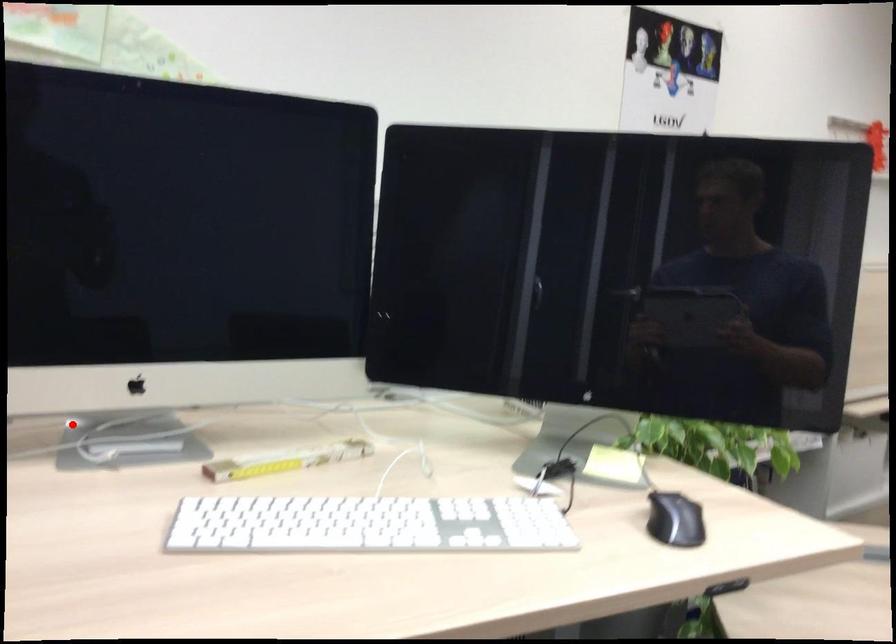
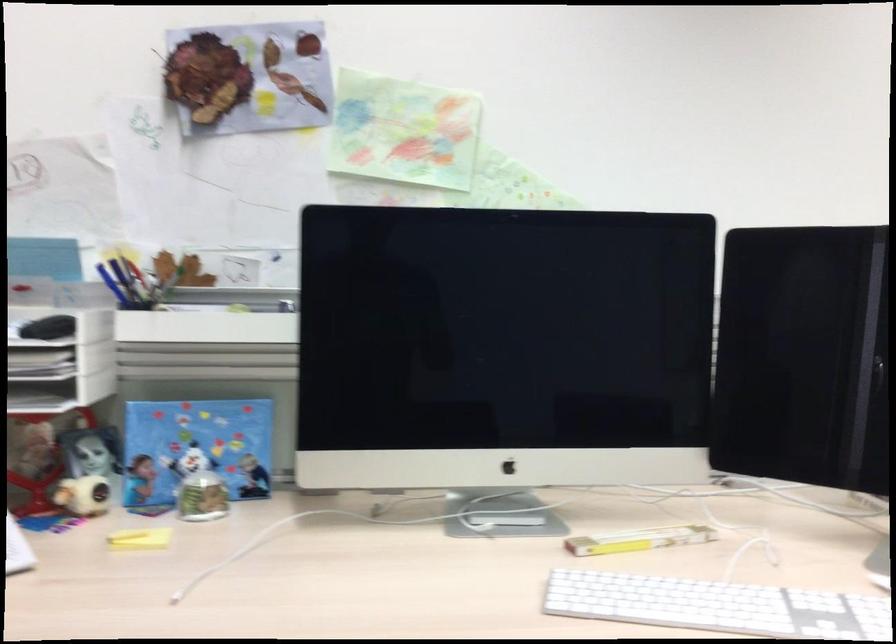
Question: I am providing you with two images of the same scene from different viewpoints. A red point is shown in image1. For the corresponding object point in image2, is it positioned nearer or farther from the camera?

Choices:
 (A) Nearer
 (B) Farther

Answer: (B)